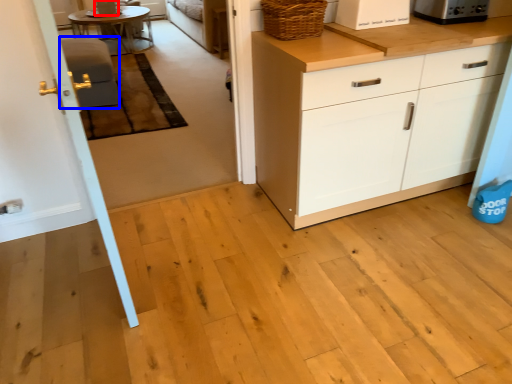
Question: Which of the following is the farthest to the observer, appliance (highlighted by a red box) or armchair (highlighted by a blue box)?

Choices:
 (A) appliance
 (B) armchair

Answer: (A)